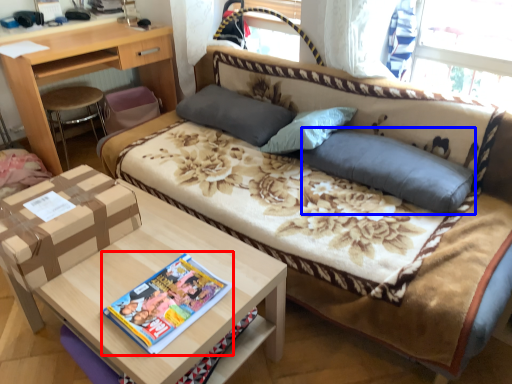
Question: Among these objects, which one is farthest to the camera, magazine (highlighted by a red box) or pillow (highlighted by a blue box)?

Choices:
 (A) magazine
 (B) pillow

Answer: (B)